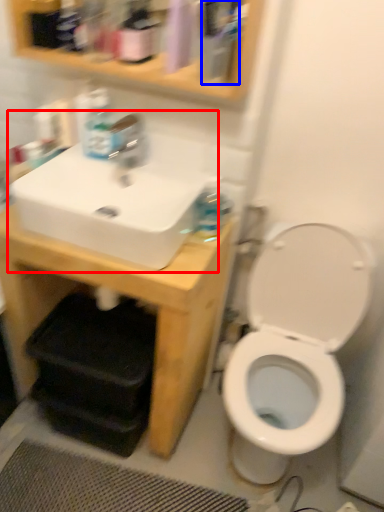
Question: Among these objects, which one is farthest to the camera, sink (highlighted by a red box) or mouthwash (highlighted by a blue box)?

Choices:
 (A) sink
 (B) mouthwash

Answer: (A)